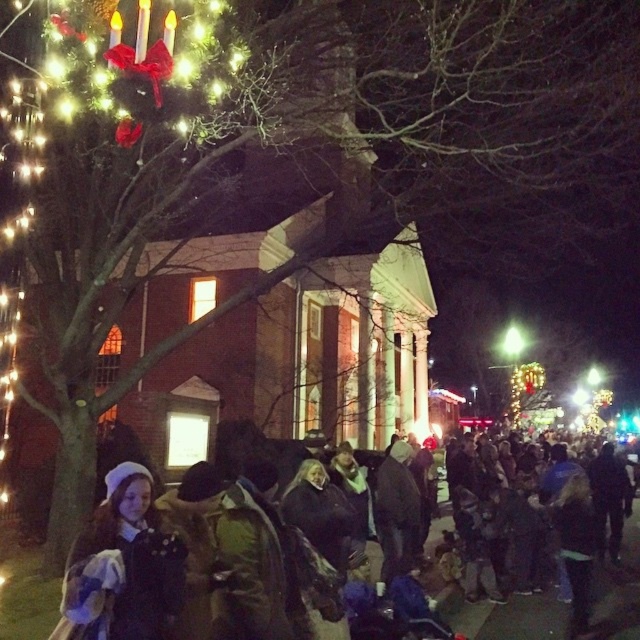
Question: In this image, where is velvet blue coat at lower left located relative to dark woolen coat at lower left?

Choices:
 (A) above
 (B) below

Answer: (A)

Question: Which of the following is the farthest from the observer?

Choices:
 (A) (118, 522)
 (B) (188, 536)

Answer: (B)

Question: Which point is farther from the camera taking this photo?

Choices:
 (A) (76, 632)
 (B) (196, 529)

Answer: (B)

Question: Observing the image, what is the correct spatial positioning of velvet blue coat at lower left in reference to dark woolen coat at lower left?

Choices:
 (A) below
 (B) above

Answer: (B)

Question: Among these objects, which one is nearest to the camera?

Choices:
 (A) velvet blue coat at lower left
 (B) dark woolen coat at lower left

Answer: (A)

Question: Does velvet blue coat at lower left have a greater width compared to dark woolen coat at lower left?

Choices:
 (A) yes
 (B) no

Answer: (B)